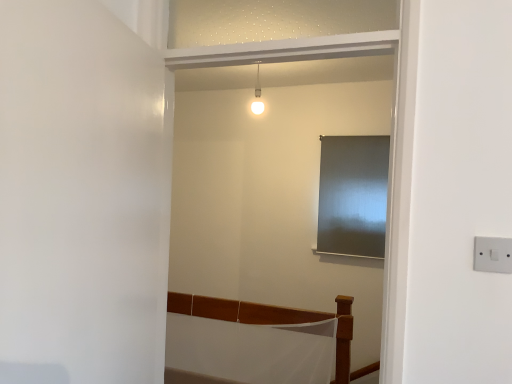
Question: From a real-world perspective, is white matte door at left on top of wooden bed frame at lower center?

Choices:
 (A) yes
 (B) no

Answer: (A)

Question: From the image's perspective, is white matte door at left beneath wooden bed frame at lower center?

Choices:
 (A) no
 (B) yes

Answer: (A)

Question: Considering the relative sizes of white matte door at left and wooden bed frame at lower center in the image provided, is white matte door at left bigger than wooden bed frame at lower center?

Choices:
 (A) yes
 (B) no

Answer: (B)

Question: Does white matte door at left have a greater width compared to wooden bed frame at lower center?

Choices:
 (A) no
 (B) yes

Answer: (A)

Question: From a real-world perspective, is white matte door at left beneath wooden bed frame at lower center?

Choices:
 (A) yes
 (B) no

Answer: (B)

Question: Is white plastic switch at right situated inside satin silver curtain at center or outside?

Choices:
 (A) outside
 (B) inside

Answer: (A)

Question: Looking at their shapes, would you say white plastic switch at right is wider or thinner than satin silver curtain at center?

Choices:
 (A) wide
 (B) thin

Answer: (B)

Question: In the image, is white plastic switch at right positioned in front of or behind satin silver curtain at center?

Choices:
 (A) behind
 (B) front

Answer: (B)

Question: Considering the positions of white plastic switch at right and satin silver curtain at center in the image, is white plastic switch at right taller or shorter than satin silver curtain at center?

Choices:
 (A) tall
 (B) short

Answer: (B)

Question: Based on their sizes in the image, would you say satin silver curtain at center is bigger or smaller than white matte door at left?

Choices:
 (A) big
 (B) small

Answer: (B)

Question: Considering their positions, is satin silver curtain at center located in front of or behind white matte door at left?

Choices:
 (A) behind
 (B) front

Answer: (A)

Question: From their relative heights in the image, would you say satin silver curtain at center is taller or shorter than white matte door at left?

Choices:
 (A) tall
 (B) short

Answer: (B)

Question: From a real-world perspective, is satin silver curtain at center positioned above or below white matte door at left?

Choices:
 (A) below
 (B) above

Answer: (B)

Question: From the image's perspective, relative to white plastic switch at right, is satin silver curtain at center above or below?

Choices:
 (A) below
 (B) above

Answer: (B)

Question: Is satin silver curtain at center situated inside white plastic switch at right or outside?

Choices:
 (A) inside
 (B) outside

Answer: (B)